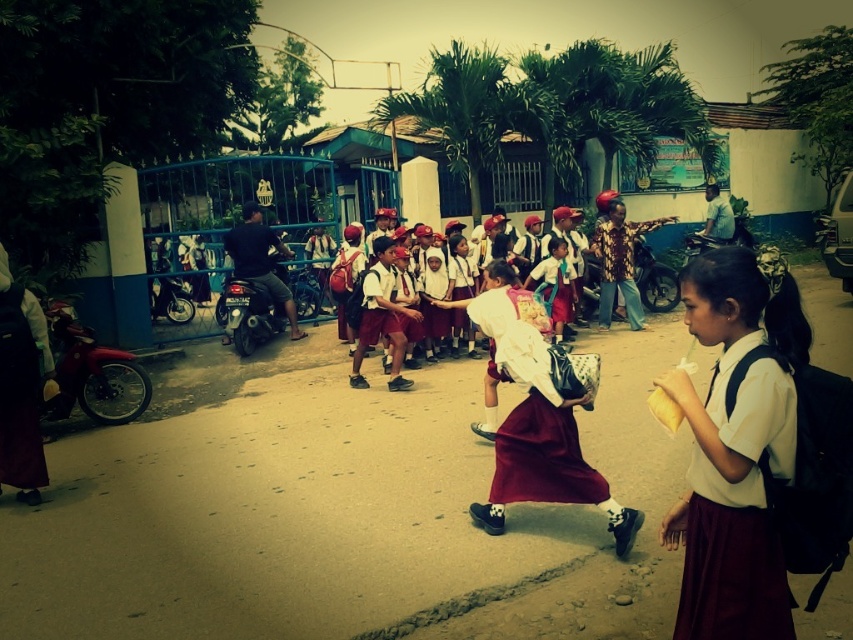
Question: Considering the relative positions of maroon fabric dress at lower right and maroon skirt at center in the image provided, where is maroon fabric dress at lower right located with respect to maroon skirt at center?

Choices:
 (A) left
 (B) right

Answer: (B)

Question: Which point appears closest to the camera in this image?

Choices:
 (A) (561, 451)
 (B) (529, 452)
 (C) (726, 480)

Answer: (C)

Question: Which point is farther to the camera?

Choices:
 (A) (485, 294)
 (B) (511, 364)
 (C) (753, 570)

Answer: (A)

Question: Which object is positioned closest to the maroon satin dress at center?

Choices:
 (A) maroon skirt at center
 (B) maroon fabric dress at lower right

Answer: (A)

Question: Is maroon skirt at center to the right of maroon satin dress at center from the viewer's perspective?

Choices:
 (A) yes
 (B) no

Answer: (B)

Question: Does maroon skirt at center have a smaller size compared to maroon satin dress at center?

Choices:
 (A) yes
 (B) no

Answer: (B)